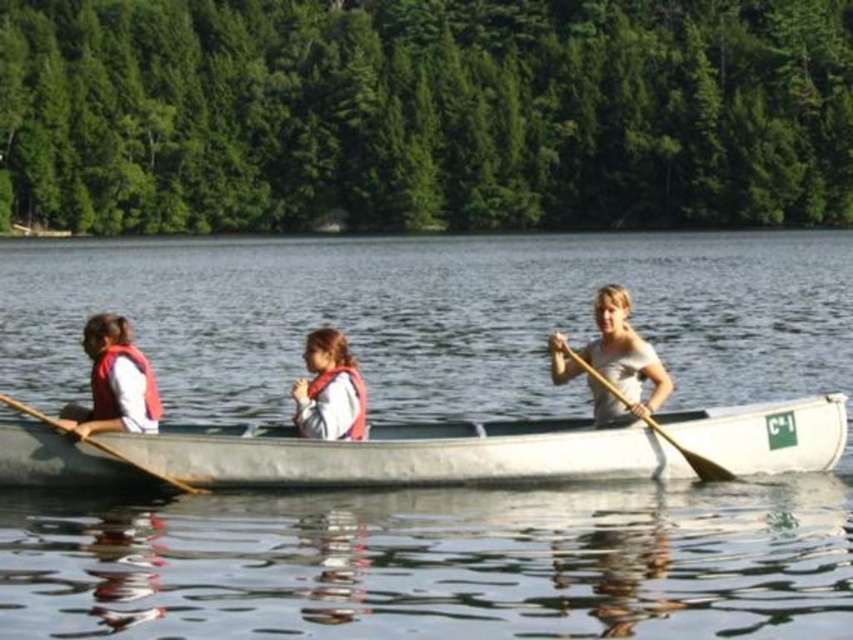
Which is more to the right, clear water at center or white cotton shirt at center?

From the viewer's perspective, white cotton shirt at center appears more on the right side.

Between clear water at center and white cotton shirt at center, which one has more height?

clear water at center is taller.

Describe the element at coordinates (434, 419) in the screenshot. Image resolution: width=853 pixels, height=640 pixels. I see `clear water at center` at that location.

Locate an element on the screen. clear water at center is located at coordinates (434, 419).

Image resolution: width=853 pixels, height=640 pixels. Identify the location of white cotton shirt at center. (621, 362).

At what (x,y) coordinates should I click in order to perform the action: click on white cotton shirt at center. Please return your answer as a coordinate pair (x, y). The image size is (853, 640). Looking at the image, I should click on (621, 362).

Locate an element on the screen. white cotton shirt at center is located at coordinates (621, 362).

Who is taller, white cotton shirt at center or white matte life vest at center?

Standing taller between the two is white matte life vest at center.

Between point (561, 353) and point (305, 397), which one is positioned behind?

The point (561, 353) is more distant.

What do you see at coordinates (621, 362) in the screenshot? I see `white cotton shirt at center` at bounding box center [621, 362].

This screenshot has width=853, height=640. Identify the location of white cotton shirt at center. (621, 362).